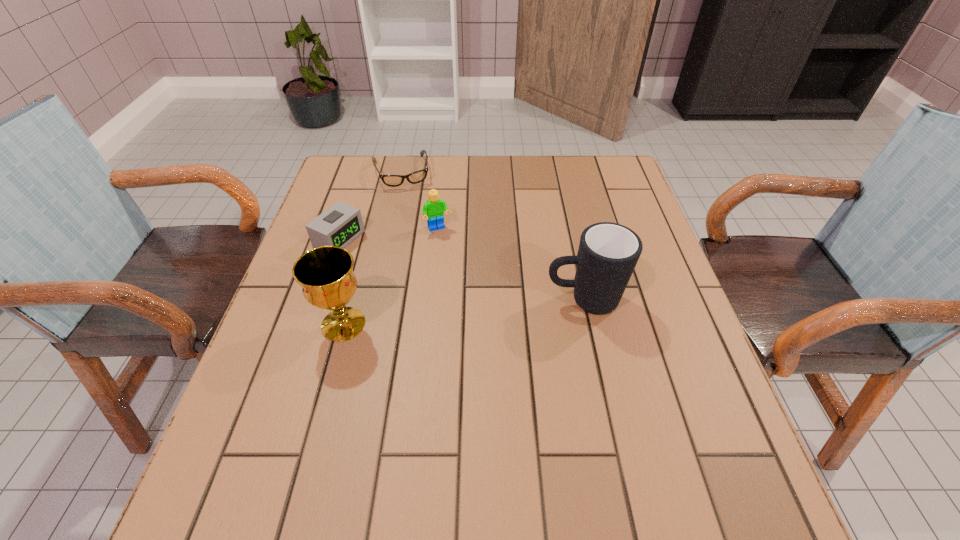
Locate an element on the screen. Image resolution: width=960 pixels, height=540 pixels. vacant space at the near right corner is located at coordinates (739, 444).

At what (x,y) coordinates should I click in order to perform the action: click on vacant point located between the alarm clock and the mug. Please return your answer as a coordinate pair (x, y). Image resolution: width=960 pixels, height=540 pixels. Looking at the image, I should click on (462, 269).

The width and height of the screenshot is (960, 540). I want to click on unoccupied area between the Lego and the chalice, so click(x=391, y=276).

Identify the location of empty space that is in between the fourth tallest object and the fourth object from left to right. (389, 234).

At what (x,y) coordinates should I click in order to perform the action: click on empty location between the chalice and the rightmost object. Please return your answer as a coordinate pair (x, y). The height and width of the screenshot is (540, 960). Looking at the image, I should click on (464, 312).

The image size is (960, 540). Find the location of `free space between the chalice and the fourth object from left to right`. free space between the chalice and the fourth object from left to right is located at coordinates (391, 276).

Locate an element on the screen. vacant area between the farthest object and the mug is located at coordinates [492, 235].

Locate an element on the screen. The image size is (960, 540). free spot between the mug and the farthest object is located at coordinates 492,235.

Identify the location of free space between the farthest object and the chalice. This screenshot has height=540, width=960. (372, 248).

At what (x,y) coordinates should I click in order to perform the action: click on vacant space in between the spectacles and the mug. Please return your answer as a coordinate pair (x, y). This screenshot has width=960, height=540. Looking at the image, I should click on (492, 235).